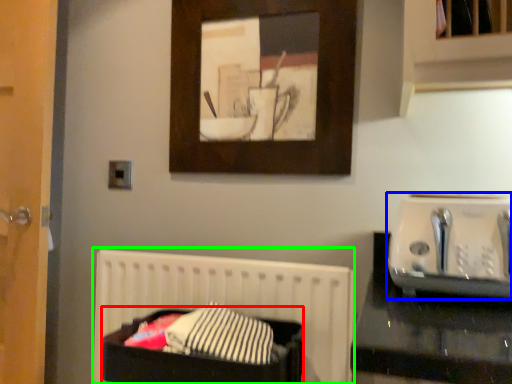
Question: Considering the real-world distances, which object is farthest from laundry basket (highlighted by a red box)? appliance (highlighted by a blue box) or bed (highlighted by a green box)?

Choices:
 (A) appliance
 (B) bed

Answer: (A)